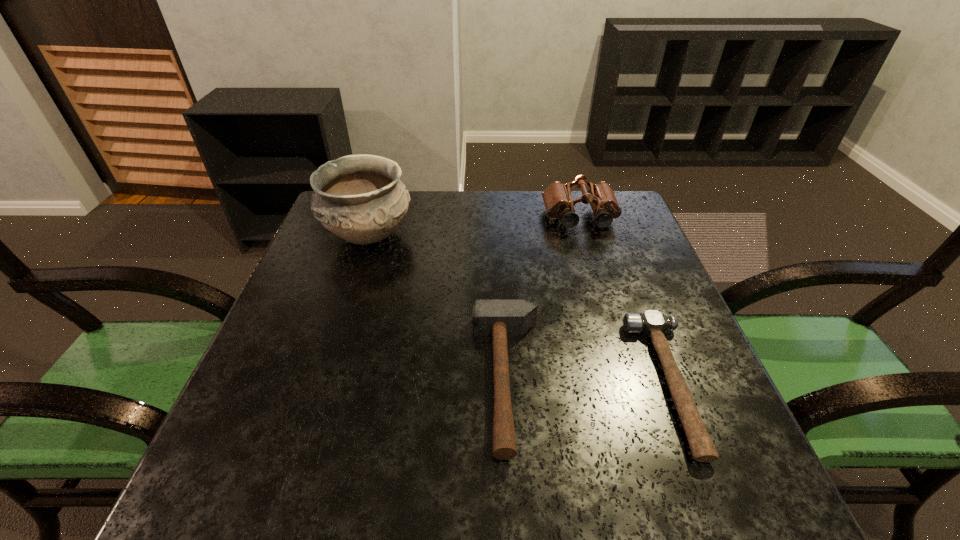
The width and height of the screenshot is (960, 540). What are the coordinates of `vacant space that satisfies the following two spatial constraints: 1. through the eyepieces of the binoculars; 2. on the striking surface of the taller hammer` in the screenshot? It's located at (630, 380).